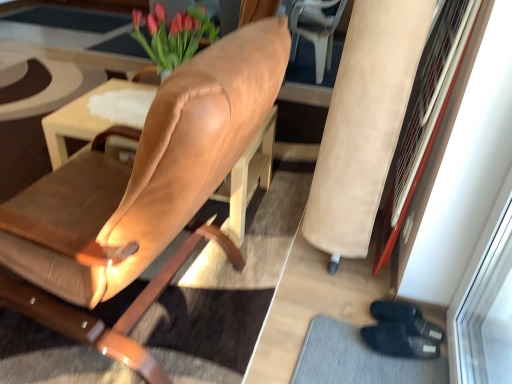
You are a GUI agent. You are given a task and a screenshot of the screen. Output one action in this format:
    pyautogui.click(x=<x>, y=<y>)
    Task: Click on the vacant region to the left of black fabric doormat at lower right
    
    Given the screenshot: What is the action you would take?
    pyautogui.click(x=260, y=331)